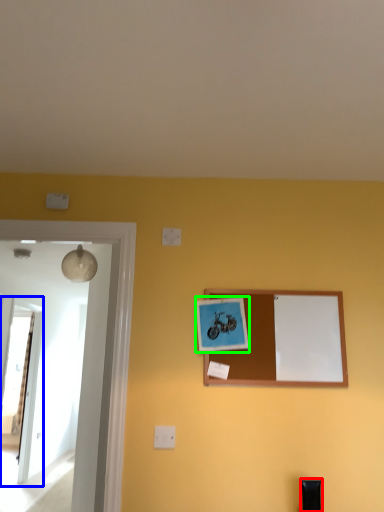
Question: Based on their relative distances, which object is farther from furniture (highlighted by a red box)? Choose from glass door (highlighted by a blue box) and picture frame (highlighted by a green box).

Choices:
 (A) glass door
 (B) picture frame

Answer: (A)